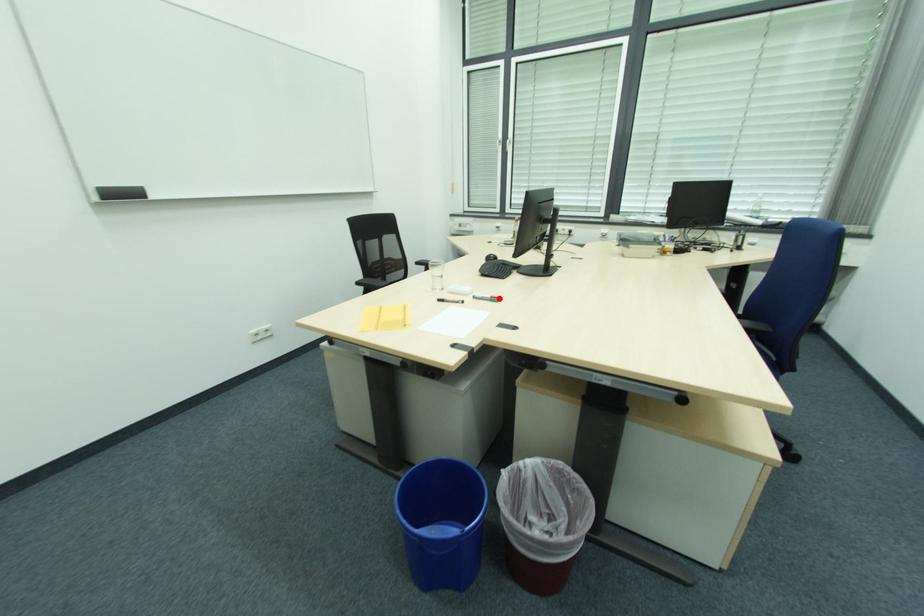
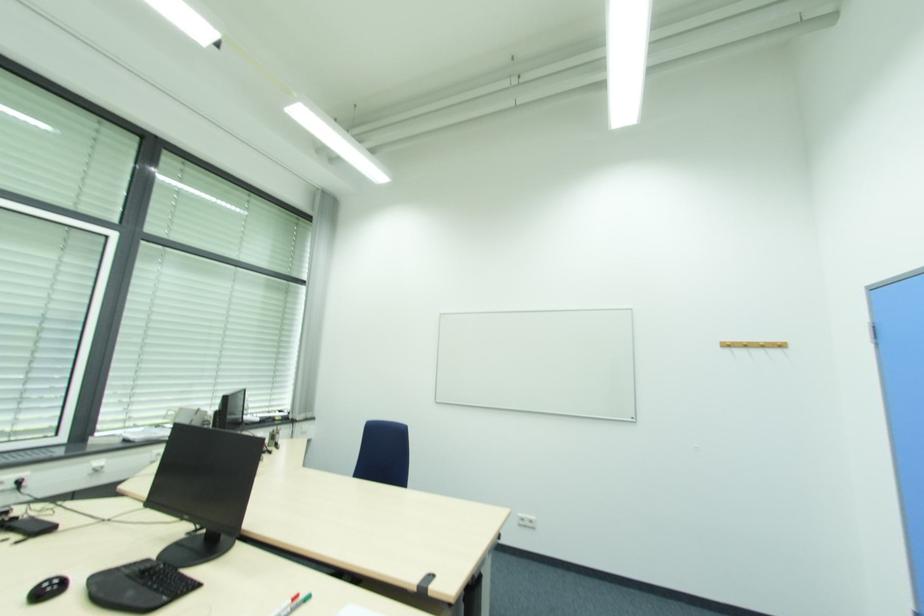
Question: I am providing you with two images of the same scene from different viewpoints. A red point is marked on the first image. At the location where the point appears in image 1, is it still visible in image 2?

Choices:
 (A) Yes
 (B) No

Answer: (A)